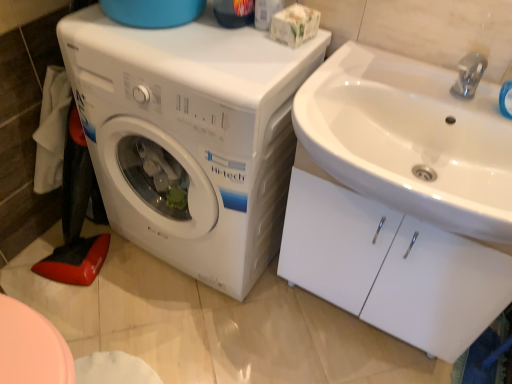
Question: From the image's perspective, is white plastic washing machine at left below white glossy sink at upper right?

Choices:
 (A) yes
 (B) no

Answer: (B)

Question: Is white glossy sink at upper right surrounded by white plastic washing machine at left?

Choices:
 (A) yes
 (B) no

Answer: (B)

Question: From a real-world perspective, is white plastic washing machine at left under white glossy sink at upper right?

Choices:
 (A) yes
 (B) no

Answer: (B)

Question: Is the surface of white plastic washing machine at left in direct contact with white glossy sink at upper right?

Choices:
 (A) yes
 (B) no

Answer: (B)

Question: From a real-world perspective, does white plastic washing machine at left stand above white glossy sink at upper right?

Choices:
 (A) no
 (B) yes

Answer: (B)

Question: Can you confirm if white plastic washing machine at left is positioned to the right of white glossy sink at upper right?

Choices:
 (A) yes
 (B) no

Answer: (B)

Question: Does white glossy sink at upper right touch white plastic washing machine at left?

Choices:
 (A) yes
 (B) no

Answer: (B)

Question: Is white glossy sink at upper right taller than white plastic washing machine at left?

Choices:
 (A) no
 (B) yes

Answer: (A)

Question: Can you confirm if white glossy sink at upper right is smaller than white plastic washing machine at left?

Choices:
 (A) yes
 (B) no

Answer: (A)

Question: Is white glossy sink at upper right oriented away from white plastic washing machine at left?

Choices:
 (A) no
 (B) yes

Answer: (A)

Question: Is the depth of white glossy sink at upper right greater than that of white plastic washing machine at left?

Choices:
 (A) no
 (B) yes

Answer: (A)

Question: From the image's perspective, is white glossy sink at upper right located above white plastic washing machine at left?

Choices:
 (A) no
 (B) yes

Answer: (A)

Question: Is white plastic washing machine at left positioned before white glossy sink at upper right?

Choices:
 (A) yes
 (B) no

Answer: (B)